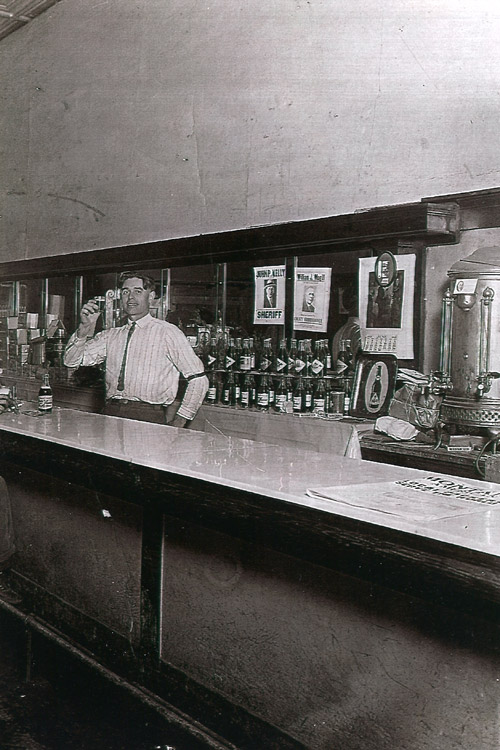
You are a GUI agent. You are given a task and a screenshot of the screen. Output one action in this format:
    pyautogui.click(x=<x>, y=<y>)
    Task: Click on the bar
    The image size is (500, 750).
    Given the screenshot: What is the action you would take?
    pyautogui.click(x=225, y=466)